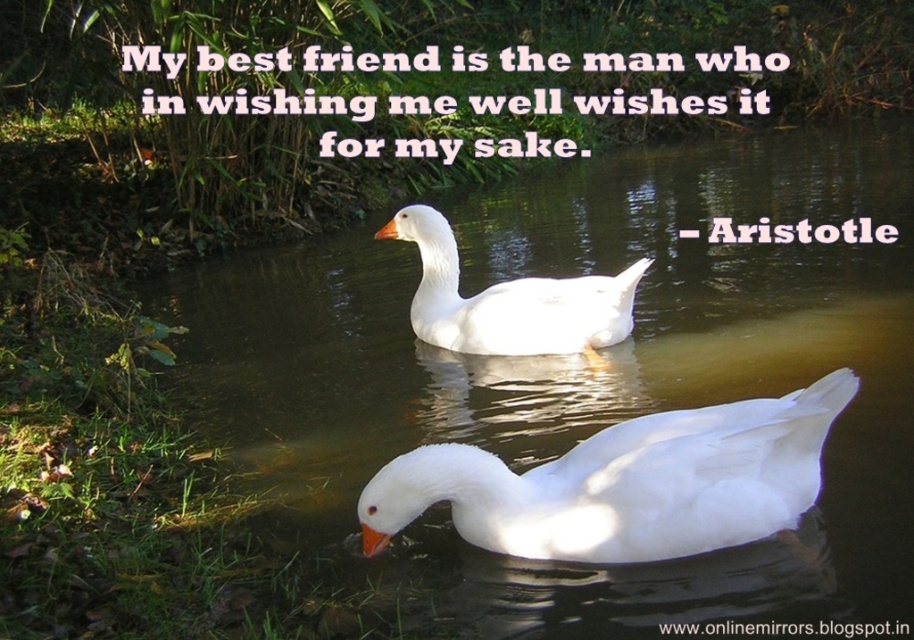
Question: Is clear water at center positioned in front of white matte swan at lower center?

Choices:
 (A) no
 (B) yes

Answer: (B)

Question: Does white matte swan at lower center appear over white matte duck at center?

Choices:
 (A) no
 (B) yes

Answer: (A)

Question: Which of these objects is positioned closest to the white matte duck at center?

Choices:
 (A) clear water at center
 (B) white matte swan at lower center

Answer: (A)

Question: Which of the following is the closest to the observer?

Choices:
 (A) white matte duck at center
 (B) clear water at center

Answer: (B)

Question: Can you confirm if clear water at center is positioned above white matte swan at lower center?

Choices:
 (A) yes
 (B) no

Answer: (A)

Question: Which point appears closest to the camera in this image?

Choices:
 (A) (x=881, y=582)
 (B) (x=851, y=376)
 (C) (x=578, y=289)

Answer: (B)